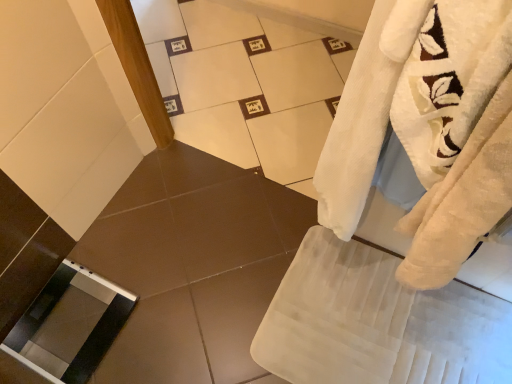
Question: Should I look upward or downward to see white soft bath towel at lower right?

Choices:
 (A) up
 (B) down

Answer: (B)

Question: Can you confirm if white soft bath towel at lower right is thinner than clear glass screen door at lower left?

Choices:
 (A) yes
 (B) no

Answer: (B)

Question: Would you consider white soft bath towel at lower right to be distant from clear glass screen door at lower left?

Choices:
 (A) yes
 (B) no

Answer: (B)

Question: Does white soft bath towel at lower right have a greater height compared to clear glass screen door at lower left?

Choices:
 (A) yes
 (B) no

Answer: (A)

Question: From the image's perspective, is white soft bath towel at lower right located beneath clear glass screen door at lower left?

Choices:
 (A) yes
 (B) no

Answer: (A)

Question: Is white soft bath towel at lower right located outside clear glass screen door at lower left?

Choices:
 (A) yes
 (B) no

Answer: (A)

Question: From a real-world perspective, is white soft bath towel at lower right located higher than clear glass screen door at lower left?

Choices:
 (A) no
 (B) yes

Answer: (B)

Question: Considering the relative sizes of clear glass screen door at lower left and white soft bath towel at lower right in the image provided, is clear glass screen door at lower left taller than white soft bath towel at lower right?

Choices:
 (A) no
 (B) yes

Answer: (A)

Question: From a real-world perspective, is clear glass screen door at lower left positioned over white soft bath towel at lower right based on gravity?

Choices:
 (A) yes
 (B) no

Answer: (B)

Question: Can we say clear glass screen door at lower left lies outside white soft bath towel at lower right?

Choices:
 (A) yes
 (B) no

Answer: (A)

Question: From a real-world perspective, is clear glass screen door at lower left under white soft bath towel at lower right?

Choices:
 (A) no
 (B) yes

Answer: (B)

Question: Are clear glass screen door at lower left and white soft bath towel at lower right making contact?

Choices:
 (A) no
 (B) yes

Answer: (A)

Question: Considering the relative positions of clear glass screen door at lower left and white soft bath towel at lower right in the image provided, is clear glass screen door at lower left to the left of white soft bath towel at lower right from the viewer's perspective?

Choices:
 (A) yes
 (B) no

Answer: (A)

Question: From a real-world perspective, relative to white soft bath towel at lower right, is clear glass screen door at lower left vertically above or below?

Choices:
 (A) above
 (B) below

Answer: (B)